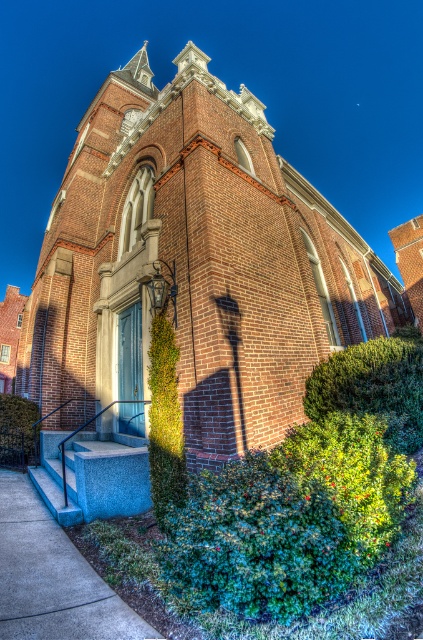
You are standing in front of the brick church at center and the green leafy hedge at center. Which object casts a longer shadow on the ground?

The brick church at center is taller than the green leafy hedge at center, so it casts a longer shadow on the ground.

From the picture: You are standing at the entrance of the brick church and looking towards the green leafy hedge at lower right. What is the direction you need to face to see the point marked at coordinates point [375,385]?

The point [375,385] corresponds to the green leafy hedge at lower right, so you should face towards the lower right direction to see it.